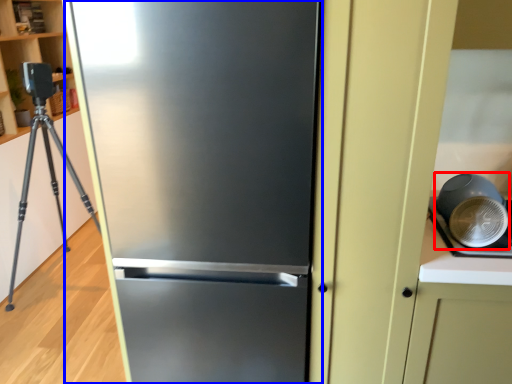
Question: Which of the following is the closest to the observer, appliance (highlighted by a red box) or refrigerator (highlighted by a blue box)?

Choices:
 (A) appliance
 (B) refrigerator

Answer: (B)